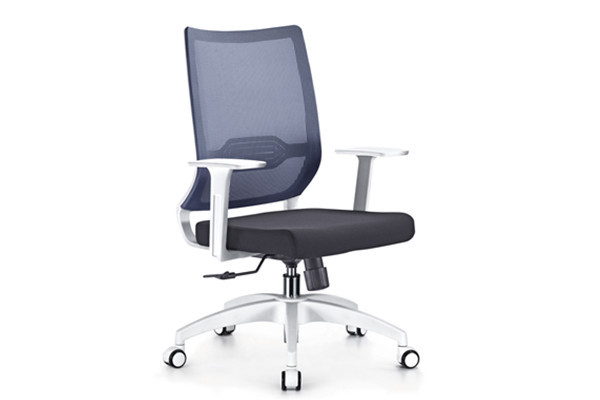
This screenshot has width=600, height=400. In order to click on 5 chair legs in this screenshot , I will do `click(246, 316)`, `click(252, 297)`, `click(294, 335)`, `click(334, 314)`, `click(334, 297)`.